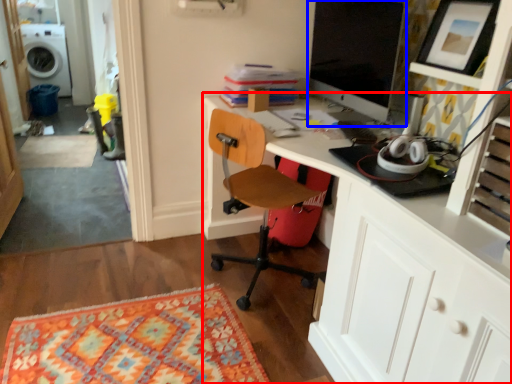
Question: Which object is closer to the camera taking this photo, desk (highlighted by a red box) or computer monitor (highlighted by a blue box)?

Choices:
 (A) desk
 (B) computer monitor

Answer: (A)